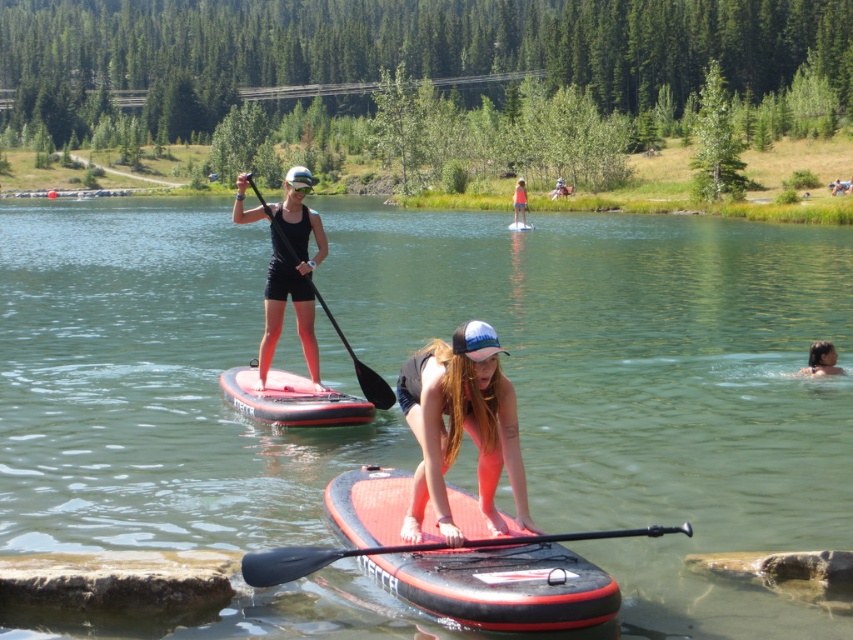
Is point (439, 545) more distant than point (514, 225)?

No.

Is point (403, 548) closer to viewer compared to point (508, 228)?

Yes, it is.

At what (x,y) coordinates should I click in order to perform the action: click on black rubber paddle at center. Please return your answer as a coordinate pair (x, y). The height and width of the screenshot is (640, 853). Looking at the image, I should click on (309, 561).

Who is lower down, pink matte surfboard at center or rubberized red paddleboard at center?

Positioned lower is pink matte surfboard at center.

This screenshot has height=640, width=853. Identify the location of pink matte surfboard at center. (461, 426).

Which is in front, point (467, 387) or point (259, 401)?

Positioned in front is point (467, 387).

Find the location of a particular element. pink matte surfboard at center is located at coordinates (461, 426).

Is black rubber paddle at center wider than black matte paddle at upper center?

Indeed, black rubber paddle at center has a greater width compared to black matte paddle at upper center.

Is point (498, 540) less distant than point (378, 378)?

Yes, it is.

Where is `black rubber paddle at center`? The image size is (853, 640). black rubber paddle at center is located at coordinates (309, 561).